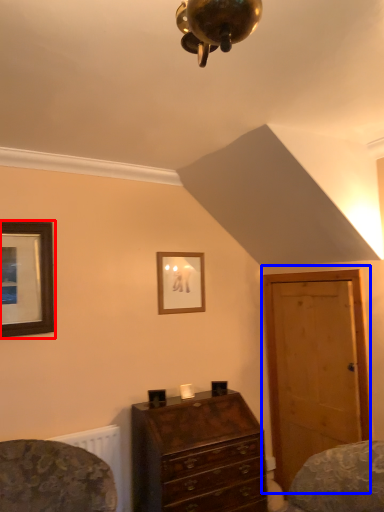
Question: Which point is further to the camera, picture frame (highlighted by a red box) or door (highlighted by a blue box)?

Choices:
 (A) picture frame
 (B) door

Answer: (B)